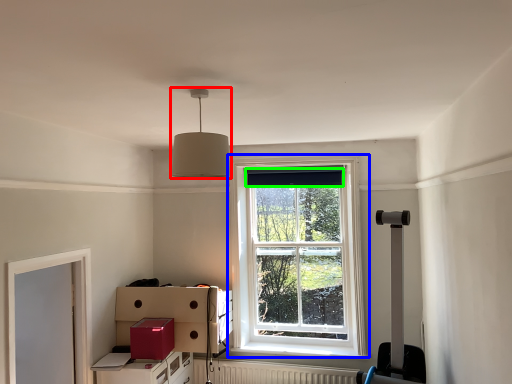
Question: Considering the real-world distances, which object is closest to lamp (highlighted by a red box)? window (highlighted by a blue box) or curtain (highlighted by a green box).

Choices:
 (A) window
 (B) curtain

Answer: (B)